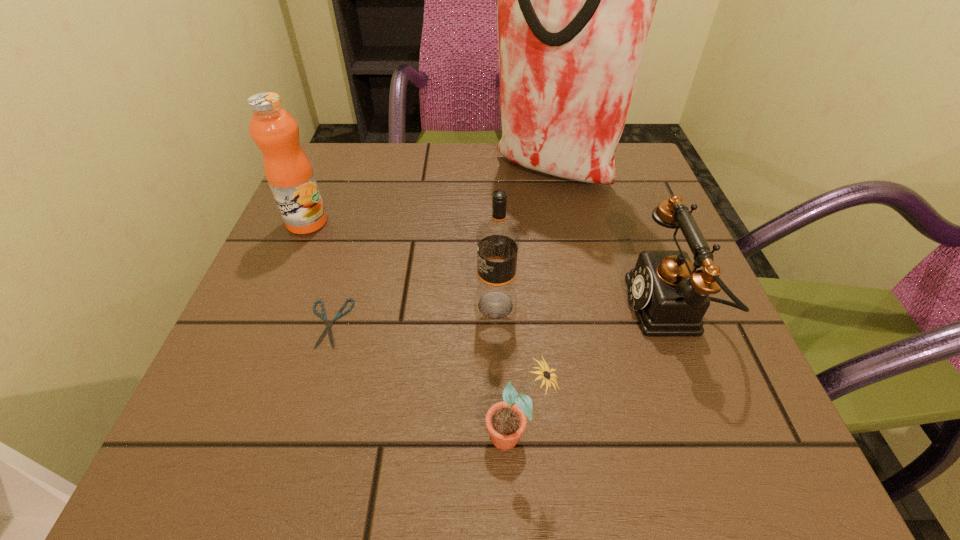
The image size is (960, 540). What are the coordinates of `grocery bag` in the screenshot? It's located at (x=575, y=0).

Locate an element on the screen. Image resolution: width=960 pixels, height=540 pixels. the tallest object is located at coordinates (575, 0).

Identify the location of the leftmost object. (289, 173).

Where is `fruit juice`? The height and width of the screenshot is (540, 960). fruit juice is located at coordinates (289, 173).

Identify the location of vodka. This screenshot has width=960, height=540. (498, 239).

The image size is (960, 540). In order to click on telephone in this screenshot , I will do `click(670, 298)`.

Image resolution: width=960 pixels, height=540 pixels. I want to click on the nearest object, so click(506, 421).

Locate an element on the screen. The height and width of the screenshot is (540, 960). the second object from left to right is located at coordinates (328, 325).

Find the location of a particular element. shears is located at coordinates (328, 325).

Where is `vacant position located 0.100m on the front of the grocery bag`? This screenshot has width=960, height=540. vacant position located 0.100m on the front of the grocery bag is located at coordinates (561, 227).